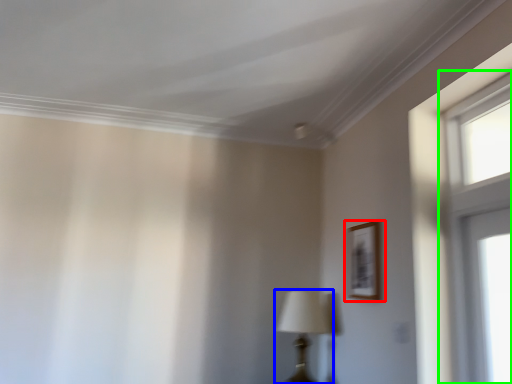
Question: Which object is the closest to the picture frame (highlighted by a red box)? Choose among these: table lamp (highlighted by a blue box) or window (highlighted by a green box).

Choices:
 (A) table lamp
 (B) window

Answer: (A)